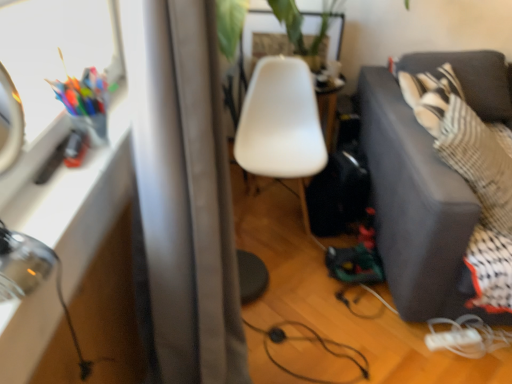
Find the location of `white matte extension cord at lower right`. white matte extension cord at lower right is located at coordinates (452, 339).

Image resolution: width=512 pixels, height=384 pixels. What do you see at coordinates (416, 207) in the screenshot? I see `dark gray fabric couch at right` at bounding box center [416, 207].

Find the location of `white plastic chair at center`. white plastic chair at center is located at coordinates (280, 122).

Identify the location of white matte extension cord at lower right. This screenshot has height=384, width=512. (452, 339).

This screenshot has width=512, height=384. What are the coordinates of `chair on the right side of clear glass table at left` in the screenshot? It's located at coord(280,122).

How many degrees apart are the facing directions of clear glass table at left and white plastic chair at center?

clear glass table at left and white plastic chair at center are facing 87.7 degrees away from each other.

Between clear glass table at left and white plastic chair at center, which one has larger size?

With larger size is white plastic chair at center.

From the image's perspective, is clear glass table at left positioned above or below white plastic chair at center?

From the image's perspective, clear glass table at left appears below white plastic chair at center.

Can you confirm if white plastic chair at center is thinner than white matte extension cord at lower right?

No.

Can you confirm if white plastic chair at center is shorter than white matte extension cord at lower right?

Incorrect, the height of white plastic chair at center does not fall short of that of white matte extension cord at lower right.

Considering the points (244, 294) and (439, 342), which point is in front, point (244, 294) or point (439, 342)?

The point (439, 342) is in front.

Between dark gray fabric couch at right and white matte extension cord at lower right, which one has larger width?

dark gray fabric couch at right is wider.

In the image, is dark gray fabric couch at right on the left side or the right side of white matte extension cord at lower right?

Based on their positions, dark gray fabric couch at right is located to the right of white matte extension cord at lower right.

In the scene shown: Can you tell me how much dark gray fabric couch at right and white matte extension cord at lower right differ in facing direction?

The facing directions of dark gray fabric couch at right and white matte extension cord at lower right are 9.79 degrees apart.

How many degrees apart are the facing directions of white matte extension cord at lower right and clear glass table at left?

They differ by 78.7 degrees in their facing directions.

Are white matte extension cord at lower right and clear glass table at left far apart?

white matte extension cord at lower right is positioned a significant distance from clear glass table at left.

In the image, is white matte extension cord at lower right positioned in front of or behind clear glass table at left?

white matte extension cord at lower right is behind clear glass table at left.

From the image's perspective, is white matte extension cord at lower right located beneath clear glass table at left?

Yes, from the image's perspective, white matte extension cord at lower right is below clear glass table at left.

Can dark gray fabric couch at right be found inside clear glass table at left?

Actually, dark gray fabric couch at right is outside clear glass table at left.

From the image's perspective, is clear glass table at left positioned above or below dark gray fabric couch at right?

From the image's perspective, clear glass table at left appears below dark gray fabric couch at right.

Is clear glass table at left turned away from dark gray fabric couch at right?

clear glass table at left is not turned away from dark gray fabric couch at right.

Considering the relative positions of clear glass table at left and dark gray fabric couch at right in the image provided, is clear glass table at left to the left or to the right of dark gray fabric couch at right?

From the image, it's evident that clear glass table at left is to the left of dark gray fabric couch at right.

Between white plastic chair at center and dark gray fabric couch at right, which one has smaller size?

white plastic chair at center is smaller.

Between point (240, 265) and point (464, 277), which one is positioned behind?

The point (240, 265) is behind.

From the image's perspective, would you say white plastic chair at center is shown under dark gray fabric couch at right?

No, from the image's perspective, white plastic chair at center is not below dark gray fabric couch at right.

What's the angular difference between white plastic chair at center and dark gray fabric couch at right's facing directions?

white plastic chair at center and dark gray fabric couch at right are facing 0.821 degrees away from each other.

Is white plastic chair at center bigger or smaller than clear glass table at left?

Considering their sizes, white plastic chair at center takes up more space than clear glass table at left.

In the scene shown: Is white plastic chair at center oriented towards clear glass table at left?

No, white plastic chair at center is not oriented towards clear glass table at left.

Is the position of white plastic chair at center less distant than that of clear glass table at left?

No, the depth of white plastic chair at center is greater than that of clear glass table at left.

Considering the relative sizes of white plastic chair at center and clear glass table at left in the image provided, is white plastic chair at center taller than clear glass table at left?

Indeed, white plastic chair at center has a greater height compared to clear glass table at left.

You are a GUI agent. You are given a task and a screenshot of the screen. Output one action in this format:
    pyautogui.click(x=<x>, y=<y>)
    Task: Click on the chair that is under the clear glass table at left (from a real-world perspective)
    
    Given the screenshot: What is the action you would take?
    pyautogui.click(x=280, y=122)

The image size is (512, 384). Find the location of `extension cord in front of the white plastic chair at center`. extension cord in front of the white plastic chair at center is located at coordinates (452, 339).

From the image, which object appears to be nearer to white plastic chair at center, dark gray fabric couch at right or white matte extension cord at lower right?

dark gray fabric couch at right lies closer to white plastic chair at center than the other object.

When comparing their distances from white plastic chair at center, does white matte extension cord at lower right or dark gray fabric couch at right seem closer?

dark gray fabric couch at right is positioned closer to the anchor white plastic chair at center.

Looking at this image, considering their positions, is white matte extension cord at lower right positioned closer to white plastic chair at center than clear glass table at left?

clear glass table at left lies closer to white plastic chair at center than the other object.

From the image, which object appears to be farther from dark gray fabric couch at right, white plastic chair at center or white matte extension cord at lower right?

The object further to dark gray fabric couch at right is white matte extension cord at lower right.

Considering their positions, is clear glass table at left positioned closer to white matte extension cord at lower right than white plastic chair at center?

white plastic chair at center is positioned closer to the anchor white matte extension cord at lower right.

Looking at the image, which one is located further to dark gray fabric couch at right, clear glass table at left or white matte extension cord at lower right?

Based on the image, clear glass table at left appears to be further to dark gray fabric couch at right.

Estimate the real-world distances between objects in this image. Which object is further from clear glass table at left, white matte extension cord at lower right or white plastic chair at center?

Among the two, white matte extension cord at lower right is located further to clear glass table at left.

Based on their spatial positions, is dark gray fabric couch at right or white plastic chair at center closer to white matte extension cord at lower right?

dark gray fabric couch at right.

Locate an element on the screen. The height and width of the screenshot is (384, 512). extension cord between clear glass table at left and white plastic chair at center in the front-back direction is located at coordinates (452, 339).

Find the location of `chair between clear glass table at left and dark gray fabric couch at right`. chair between clear glass table at left and dark gray fabric couch at right is located at coordinates (280, 122).

Where is `extension cord between white plastic chair at center and dark gray fabric couch at right`? Image resolution: width=512 pixels, height=384 pixels. extension cord between white plastic chair at center and dark gray fabric couch at right is located at coordinates (452, 339).

Locate an element on the screen. The height and width of the screenshot is (384, 512). extension cord between clear glass table at left and dark gray fabric couch at right in the horizontal direction is located at coordinates (452, 339).